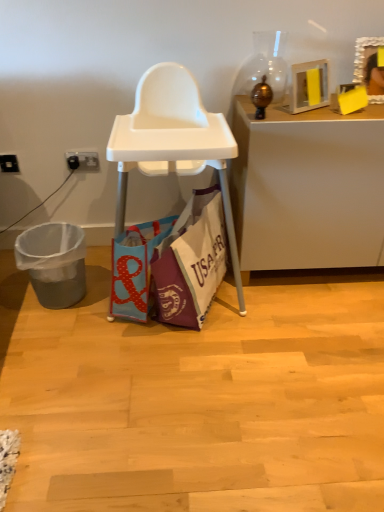
The width and height of the screenshot is (384, 512). I want to click on vacant region to the right of white plastic high chair at center, so click(x=316, y=320).